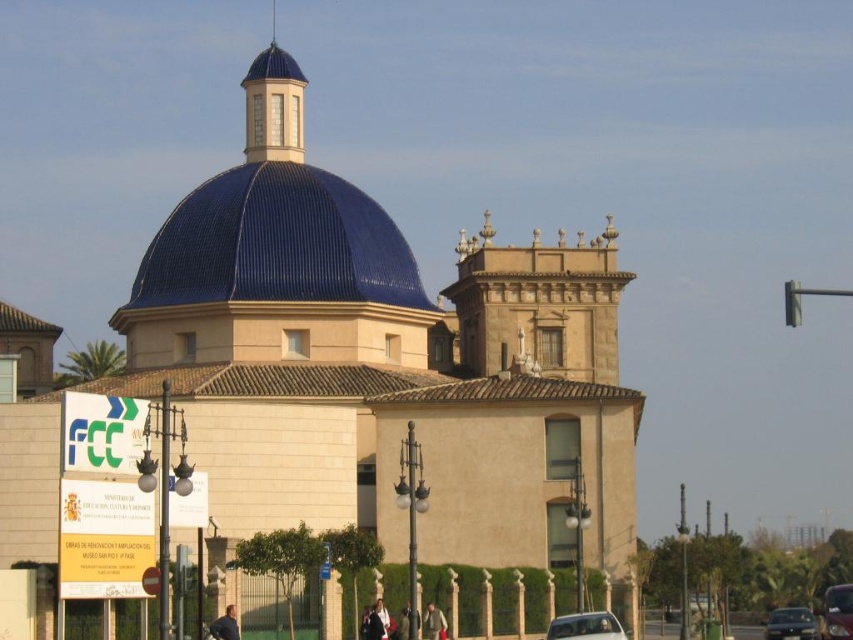
Who is shorter, metallic silver car at center or metallic silver car at lower right?

Standing shorter between the two is metallic silver car at center.

The width and height of the screenshot is (853, 640). What are the coordinates of `metallic silver car at center` in the screenshot? It's located at tap(791, 624).

Is point (785, 636) closer to camera compared to point (846, 593)?

No.

Find the location of a particular element. This screenshot has height=640, width=853. metallic silver car at center is located at coordinates (791, 624).

What do you see at coordinates (276, 224) in the screenshot?
I see `blue ceramic dome at center` at bounding box center [276, 224].

Between blue ceramic dome at center and metallic silver car at lower right, which one has more height?

With more height is blue ceramic dome at center.

Which is behind, point (299, 72) or point (834, 630)?

Point (299, 72)

Locate an element on the screen. The image size is (853, 640). blue ceramic dome at center is located at coordinates (276, 224).

Which of these two, blue glass dome at upper center or metallic silver car at lower right, stands shorter?

Standing shorter between the two is metallic silver car at lower right.

Is point (273, 81) closer to viewer compared to point (828, 595)?

No, (273, 81) is further to viewer.

This screenshot has width=853, height=640. I want to click on blue glass dome at upper center, so click(273, 104).